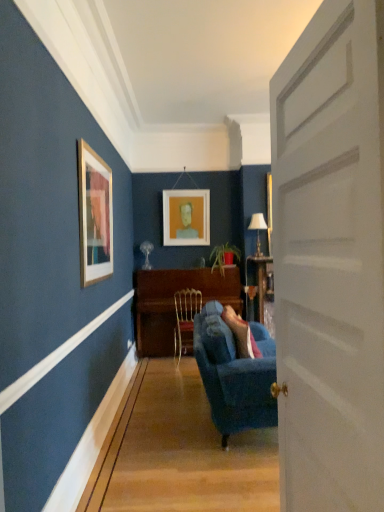
Question: From a real-world perspective, is wooden piano at center located higher than metallic gold chair at center?

Choices:
 (A) yes
 (B) no

Answer: (A)

Question: Is the position of wooden piano at center less distant than that of metallic gold chair at center?

Choices:
 (A) yes
 (B) no

Answer: (B)

Question: Is wooden piano at center thinner than metallic gold chair at center?

Choices:
 (A) yes
 (B) no

Answer: (B)

Question: Does wooden piano at center have a lesser height compared to metallic gold chair at center?

Choices:
 (A) yes
 (B) no

Answer: (B)

Question: Does wooden piano at center have a greater height compared to metallic gold chair at center?

Choices:
 (A) no
 (B) yes

Answer: (B)

Question: From a real-world perspective, is wooden piano at center under metallic gold chair at center?

Choices:
 (A) no
 (B) yes

Answer: (A)

Question: Is wooden piano at center with white matte door at center?

Choices:
 (A) yes
 (B) no

Answer: (B)

Question: From a real-world perspective, is wooden piano at center located higher than white matte door at center?

Choices:
 (A) no
 (B) yes

Answer: (A)

Question: Is wooden piano at center at the right side of white matte door at center?

Choices:
 (A) no
 (B) yes

Answer: (A)

Question: Considering the relative sizes of wooden piano at center and white matte door at center in the image provided, is wooden piano at center thinner than white matte door at center?

Choices:
 (A) no
 (B) yes

Answer: (A)

Question: Can you confirm if wooden piano at center is taller than white matte door at center?

Choices:
 (A) no
 (B) yes

Answer: (A)

Question: From the image's perspective, does wooden piano at center appear lower than white matte door at center?

Choices:
 (A) yes
 (B) no

Answer: (A)

Question: From a real-world perspective, is white matte door at center over white matte picture frame at center?

Choices:
 (A) yes
 (B) no

Answer: (B)